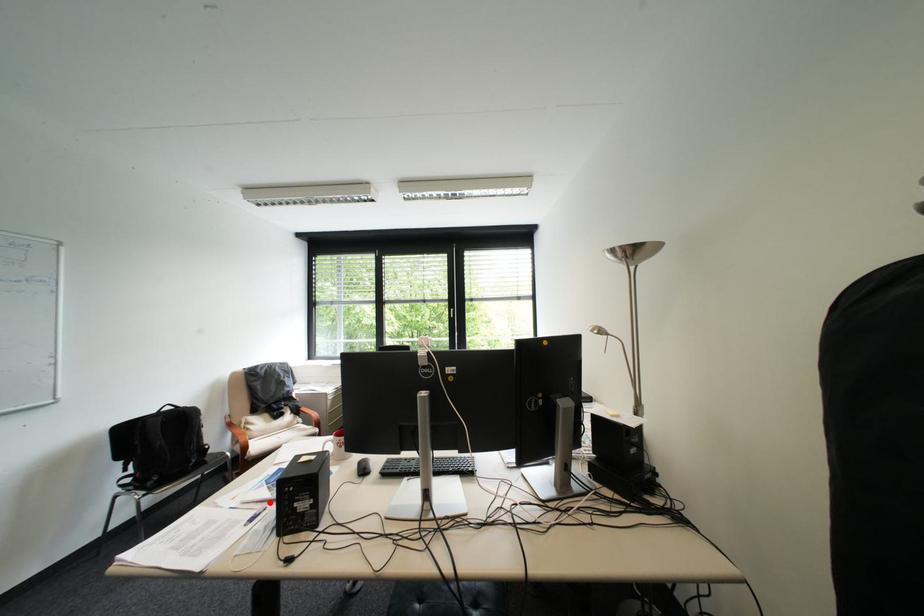
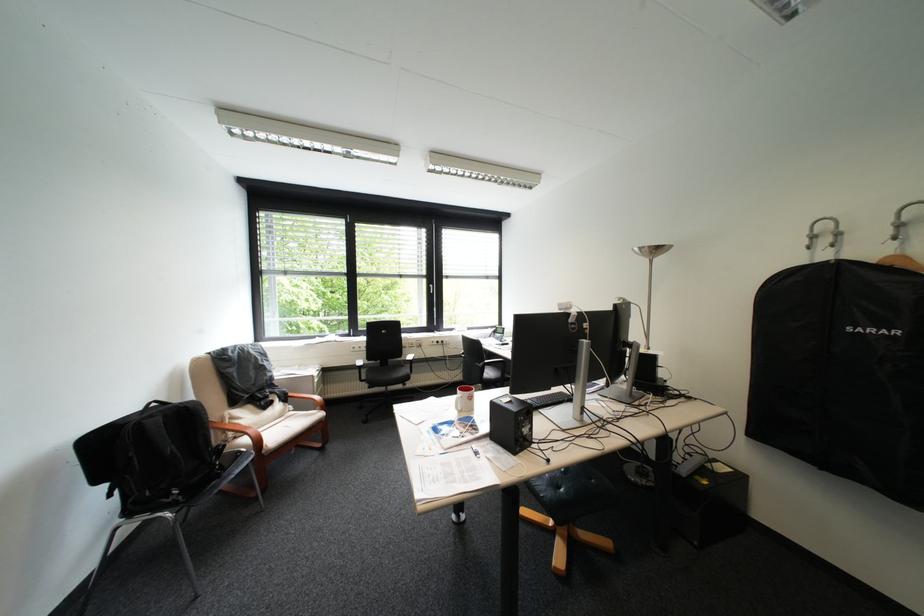
Where in the second image is the point corresponding to the highlighted location from the first image?

(469, 446)